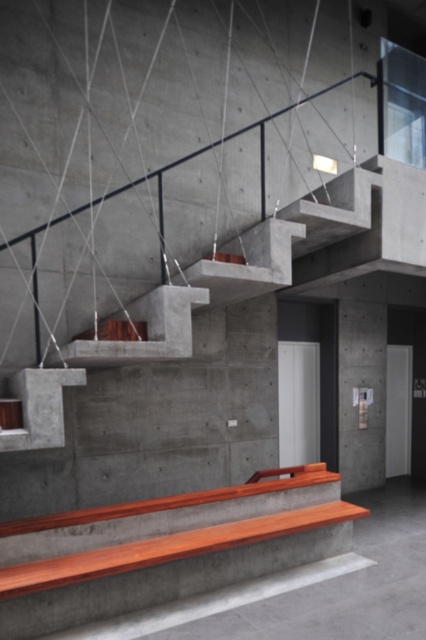
Is the position of polished wood bench at lower center less distant than that of concrete/stained wood stairs at center?

That is False.

Does polished wood bench at lower center appear over concrete/stained wood stairs at center?

Actually, polished wood bench at lower center is below concrete/stained wood stairs at center.

This screenshot has height=640, width=426. What are the coordinates of `polished wood bench at lower center` in the screenshot? It's located at (170, 554).

The image size is (426, 640). I want to click on polished wood bench at lower center, so click(x=170, y=554).